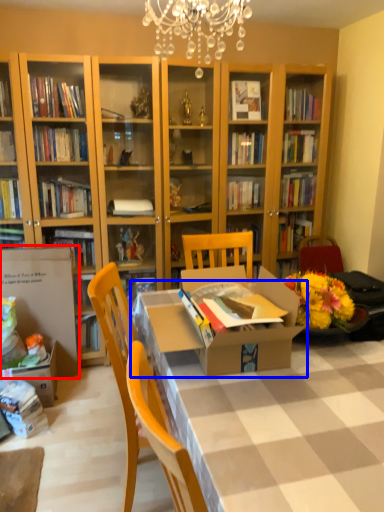
Question: Which object is further to the camera taking this photo, cardboard box (highlighted by a red box) or table (highlighted by a blue box)?

Choices:
 (A) cardboard box
 (B) table

Answer: (A)